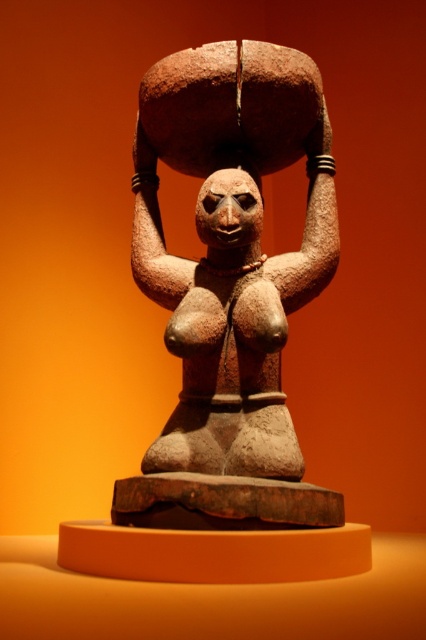
Which is behind, point (164, 458) or point (259, 221)?

Positioned behind is point (259, 221).

Is brown stone statue at center to the left of matte brown head at center from the viewer's perspective?

Yes, brown stone statue at center is to the left of matte brown head at center.

Does point (247, 154) lie behind point (207, 216)?

Yes.

I want to click on brown stone statue at center, so click(x=230, y=285).